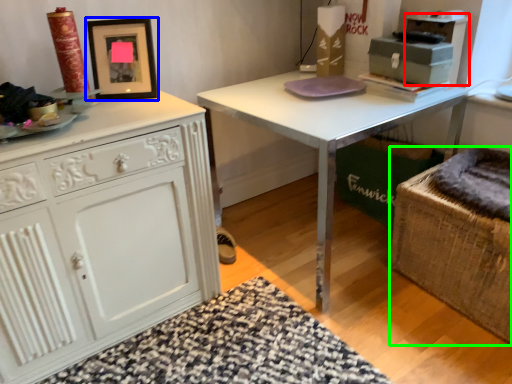
Question: Which is nearer to the cabinetry (highlighted by a red box)? picture frame (highlighted by a blue box) or swivel chair (highlighted by a green box).

Choices:
 (A) picture frame
 (B) swivel chair

Answer: (B)